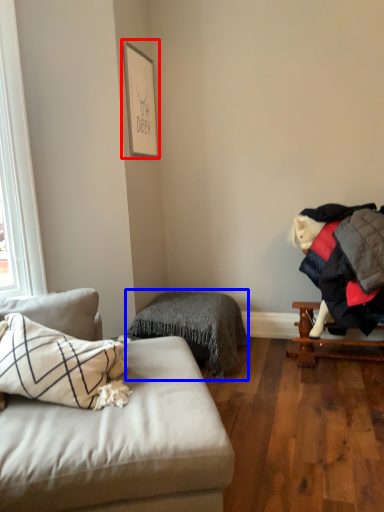
Question: Which object is further to the camera taking this photo, picture frame (highlighted by a red box) or bedding (highlighted by a blue box)?

Choices:
 (A) picture frame
 (B) bedding

Answer: (A)